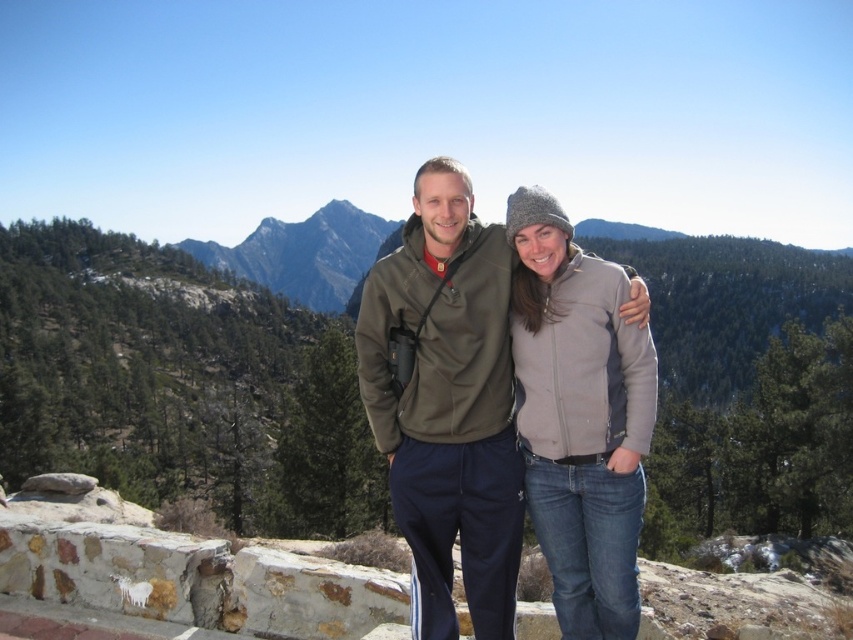
Question: Which of the following is the farthest from the observer?

Choices:
 (A) gray fleece jacket at center
 (B) matte olive-green jacket at center

Answer: (B)

Question: Where is matte olive-green jacket at center located in relation to gray fleece jacket at center in the image?

Choices:
 (A) right
 (B) left

Answer: (B)

Question: Among these objects, which one is farthest from the camera?

Choices:
 (A) matte olive-green jacket at center
 (B) gray fleece jacket at center

Answer: (A)

Question: Is matte olive-green jacket at center smaller than gray fleece jacket at center?

Choices:
 (A) yes
 (B) no

Answer: (B)

Question: Considering the relative positions of matte olive-green jacket at center and gray fleece jacket at center in the image provided, where is matte olive-green jacket at center located with respect to gray fleece jacket at center?

Choices:
 (A) above
 (B) below

Answer: (A)

Question: Which of the following is the farthest from the observer?

Choices:
 (A) (494, 333)
 (B) (612, 563)

Answer: (A)